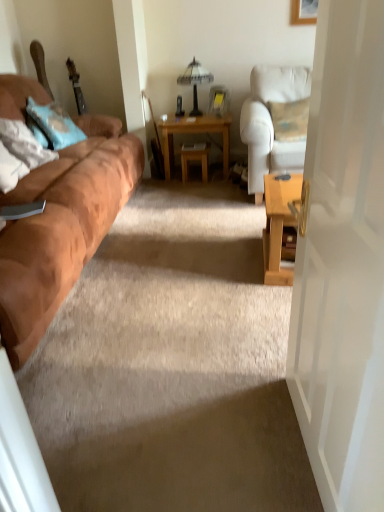
The height and width of the screenshot is (512, 384). In order to click on free space in front of wooden stool at center in this screenshot , I will do `click(205, 185)`.